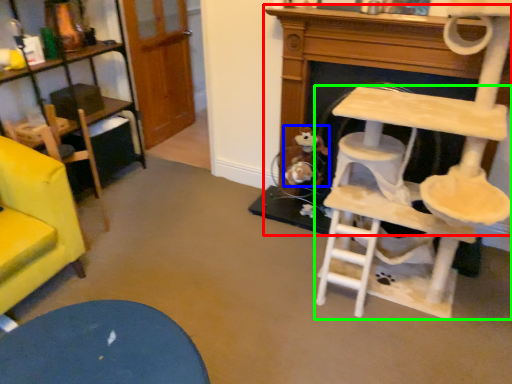
Question: Based on their relative distances, which object is farther from fireplace (highlighted by a red box)? Choose from toy (highlighted by a blue box) and table (highlighted by a green box).

Choices:
 (A) toy
 (B) table

Answer: (B)